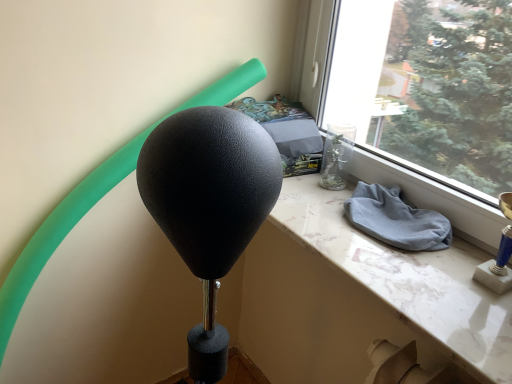
Locate an element on the screen. The width and height of the screenshot is (512, 384). free spot above white marble table at center (from a real-world perspective) is located at coordinates (369, 236).